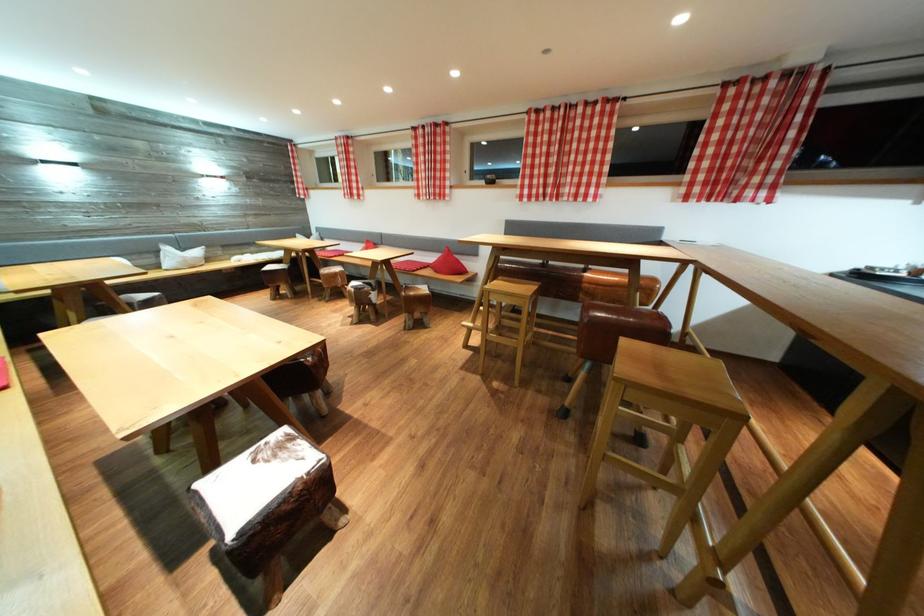
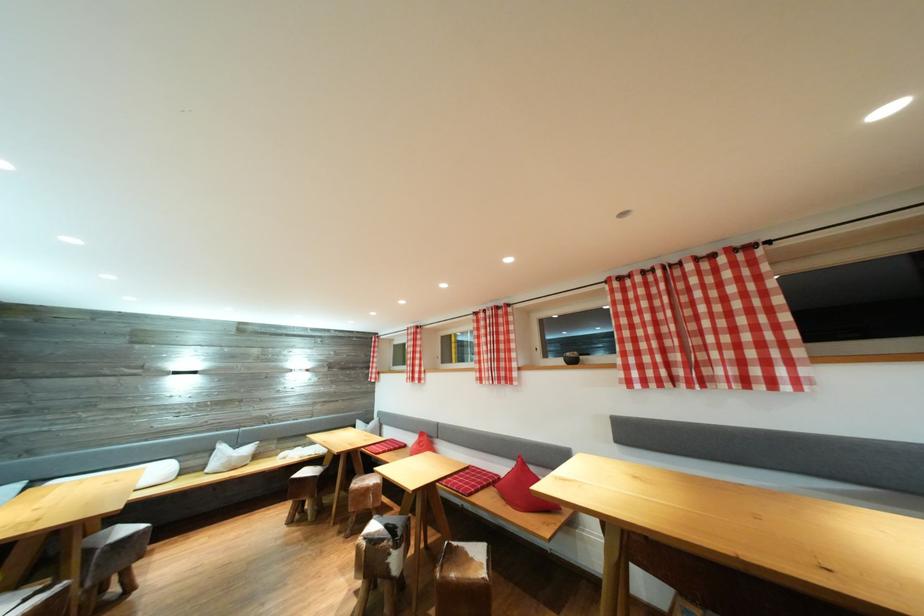
The images are taken continuously from a first-person perspective. In which direction is your viewpoint rotating?

The camera's rotation is toward left-up.